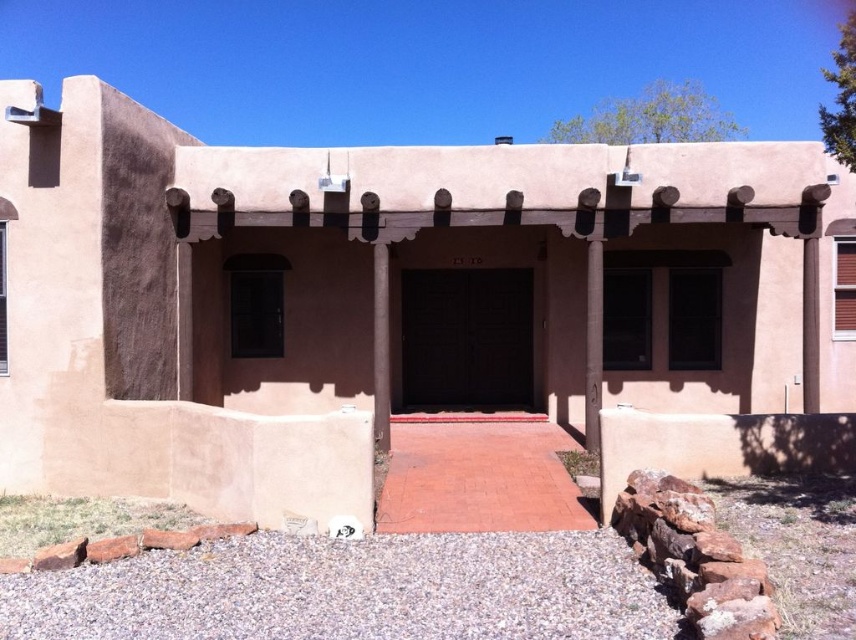
Question: Which object is closer to the camera taking this photo?

Choices:
 (A) brown wood pillar at center
 (B) smooth concrete pillar at center

Answer: (B)

Question: Is smooth concrete pillar at center positioned at the back of brown wood pillar at center?

Choices:
 (A) no
 (B) yes

Answer: (A)

Question: Which of the following is the closest to the observer?

Choices:
 (A) smooth concrete pillar at center
 (B) brown wood pillar at center

Answer: (A)

Question: Can you confirm if smooth concrete pillar at center is positioned to the left of brown wood pillar at center?

Choices:
 (A) yes
 (B) no

Answer: (B)

Question: Is smooth concrete pillar at center thinner than brown wood pillar at center?

Choices:
 (A) no
 (B) yes

Answer: (A)